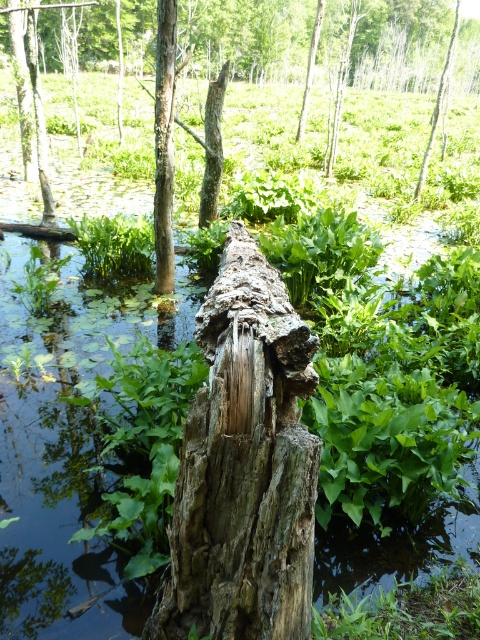
You are an environmental scientist assessing the wetland. You need to determine which object has a smaller width between the weathered wood stump at center and the smooth bark tree trunk at center. Which one is narrower?

The weathered wood stump at center has a smaller width than the smooth bark tree trunk at center.

You are standing in the wetland scene and want to reach the point at coordinates point [295,632]. If your height is 1.7 meters, will you be able to see the point from your current position?

The point [295,632] is 1.63 meters away from the viewer. Since the viewer is 1.7 meters tall, they can likely see the point as it is within a reasonable line of sight distance, assuming no obstructions like tall plants or the tree stump block the view.

You are standing at the edge of the wetland and want to take a photo of both point (223, 538) and point (156, 273). Which point should you focus on first to ensure both are in clear view?

You should focus on point (223, 538) first because it is closer to the camera than point (156, 273), ensuring both points are in focus when using a shallow depth of field.